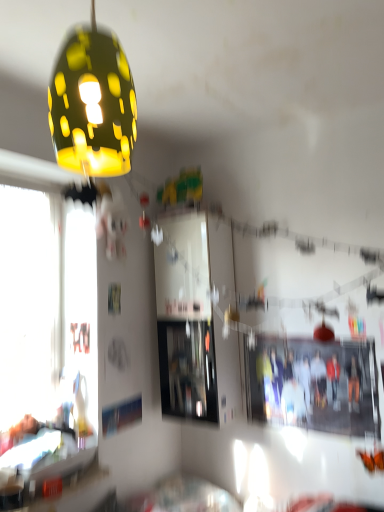
You are a GUI agent. You are given a task and a screenshot of the screen. Output one action in this format:
    pyautogui.click(x=<x>, y=<y>)
    Task: Click on the matte yellow lampshade at upper left
    The width and height of the screenshot is (384, 512).
    Given the screenshot: What is the action you would take?
    pyautogui.click(x=92, y=104)

What do you see at coordinates (92, 104) in the screenshot? The width and height of the screenshot is (384, 512). I see `matte yellow lampshade at upper left` at bounding box center [92, 104].

Locate an element on the screen. matte black photo at center is located at coordinates (313, 384).

This screenshot has width=384, height=512. What do you see at coordinates (313, 384) in the screenshot?
I see `matte black photo at center` at bounding box center [313, 384].

Looking at this image, what is the approximate width of matte black photo at center?

matte black photo at center is 2.28 centimeters wide.

What are the coordinates of `matte yellow lampshade at upper left` in the screenshot? It's located at (92, 104).

Which is more to the left, matte yellow lampshade at upper left or matte black photo at center?

matte yellow lampshade at upper left.

Is the depth of matte yellow lampshade at upper left less than that of matte black photo at center?

Yes, it is.

Does point (119, 96) lie behind point (368, 401)?

No.

From the image's perspective, which one is positioned lower, matte yellow lampshade at upper left or matte black photo at center?

matte black photo at center is shown below in the image.

From a real-world perspective, relative to matte black photo at center, is matte yellow lampshade at upper left vertically above or below?

matte yellow lampshade at upper left is above matte black photo at center.

Does matte yellow lampshade at upper left have a lesser width compared to matte black photo at center?

No.

From their relative heights in the image, would you say matte yellow lampshade at upper left is taller or shorter than matte black photo at center?

In the image, matte yellow lampshade at upper left appears to be shorter than matte black photo at center.

Considering the relative sizes of matte yellow lampshade at upper left and matte black photo at center in the image provided, is matte yellow lampshade at upper left smaller than matte black photo at center?

No.

Is matte black photo at center surrounded by matte yellow lampshade at upper left?

Actually, matte black photo at center is outside matte yellow lampshade at upper left.

Are matte yellow lampshade at upper left and matte black photo at center located far from each other?

Indeed, matte yellow lampshade at upper left is not near matte black photo at center.

Could you tell me if matte yellow lampshade at upper left is facing matte black photo at center?

No, matte yellow lampshade at upper left is not turned towards matte black photo at center.

Can you tell me how much matte yellow lampshade at upper left and matte black photo at center differ in facing direction?

The facing directions of matte yellow lampshade at upper left and matte black photo at center are 88.9 degrees apart.

Measure the distance between matte yellow lampshade at upper left and matte black photo at center.

6.28 feet.

Image resolution: width=384 pixels, height=512 pixels. Find the location of `lamp in front of the matte black photo at center`. lamp in front of the matte black photo at center is located at coordinates (92, 104).

Visually, is matte black photo at center positioned to the left or to the right of matte yellow lampshade at upper left?

matte black photo at center is positioned on matte yellow lampshade at upper left's right side.

Which is in front, matte black photo at center or matte yellow lampshade at upper left?

matte yellow lampshade at upper left is more forward.

Based on the photo, which point is more distant from viewer, (337,343) or (57,133)?

Positioned behind is point (337,343).

From the image's perspective, between matte black photo at center and matte yellow lampshade at upper left, who is located below?

From the image's view, matte black photo at center is below.

From a real-world perspective, is matte black photo at center over matte yellow lampshade at upper left?

Incorrect, from a real-world perspective, matte black photo at center is lower than matte yellow lampshade at upper left.

Looking at their sizes, would you say matte black photo at center is wider or thinner than matte yellow lampshade at upper left?

matte black photo at center is thinner than matte yellow lampshade at upper left.

Which of these two, matte black photo at center or matte yellow lampshade at upper left, stands shorter?

Standing shorter between the two is matte yellow lampshade at upper left.

From the picture: Considering the sizes of objects matte black photo at center and matte yellow lampshade at upper left in the image provided, who is smaller, matte black photo at center or matte yellow lampshade at upper left?

With smaller size is matte black photo at center.

Is matte yellow lampshade at upper left surrounded by matte black photo at center?

Actually, matte yellow lampshade at upper left is outside matte black photo at center.

Would you consider matte black photo at center to be distant from matte yellow lampshade at upper left?

Indeed, matte black photo at center is not near matte yellow lampshade at upper left.

Does matte black photo at center turn towards matte yellow lampshade at upper left?

No.

Can you tell me how much matte black photo at center and matte yellow lampshade at upper left differ in facing direction?

matte black photo at center and matte yellow lampshade at upper left are facing 88.9 degrees away from each other.

At what (x,y) coordinates should I click in order to perform the action: click on lamp lying in front of the matte black photo at center. Please return your answer as a coordinate pair (x, y). Looking at the image, I should click on (92, 104).

At what (x,y) coordinates should I click in order to perform the action: click on bulletin board directly beneath the matte yellow lampshade at upper left (from a real-world perspective). Please return your answer as a coordinate pair (x, y). The height and width of the screenshot is (512, 384). Looking at the image, I should click on (313, 384).

Identify the location of lamp in front of the matte black photo at center. The image size is (384, 512). (92, 104).